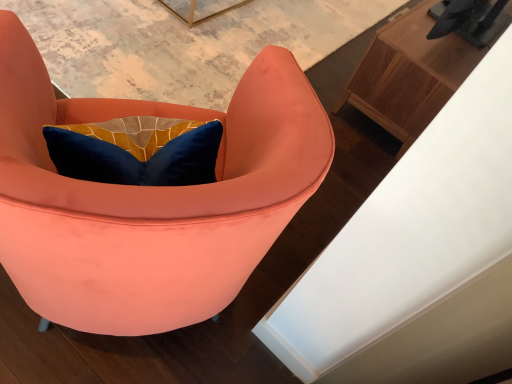
Question: Which is correct: matte coral armchair at center is inside wooden cabinet at upper right, or outside of it?

Choices:
 (A) inside
 (B) outside

Answer: (B)

Question: Looking at their shapes, would you say matte coral armchair at center is wider or thinner than wooden cabinet at upper right?

Choices:
 (A) wide
 (B) thin

Answer: (A)

Question: Relative to wooden cabinet at upper right, is matte coral armchair at center in front or behind?

Choices:
 (A) behind
 (B) front

Answer: (B)

Question: From the image's perspective, is wooden cabinet at upper right positioned above or below matte coral armchair at center?

Choices:
 (A) below
 (B) above

Answer: (B)

Question: Visually, is wooden cabinet at upper right positioned to the left or to the right of matte coral armchair at center?

Choices:
 (A) right
 (B) left

Answer: (A)

Question: Is wooden cabinet at upper right situated inside matte coral armchair at center or outside?

Choices:
 (A) inside
 (B) outside

Answer: (B)

Question: From a real-world perspective, is wooden cabinet at upper right physically located above or below matte coral armchair at center?

Choices:
 (A) below
 (B) above

Answer: (A)